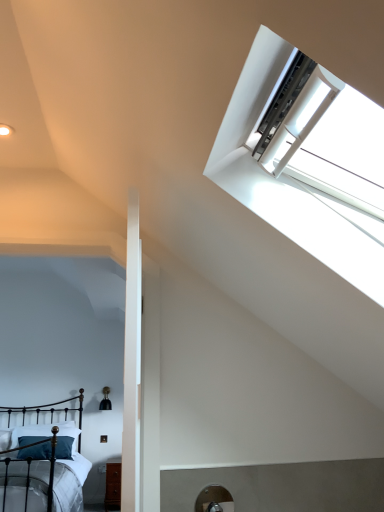
Question: Is dark blue fabric pillow at lower left in front of black wrought iron bed at lower left?

Choices:
 (A) yes
 (B) no

Answer: (B)

Question: Is dark blue fabric pillow at lower left at the left side of black wrought iron bed at lower left?

Choices:
 (A) yes
 (B) no

Answer: (B)

Question: Is dark blue fabric pillow at lower left at the right side of black wrought iron bed at lower left?

Choices:
 (A) no
 (B) yes

Answer: (B)

Question: Does dark blue fabric pillow at lower left have a lesser width compared to black wrought iron bed at lower left?

Choices:
 (A) no
 (B) yes

Answer: (B)

Question: Can you confirm if dark blue fabric pillow at lower left is smaller than black wrought iron bed at lower left?

Choices:
 (A) yes
 (B) no

Answer: (A)

Question: Is dark blue fabric pillow at lower left positioned with its back to black wrought iron bed at lower left?

Choices:
 (A) no
 (B) yes

Answer: (B)

Question: Is white plastic window at upper right surrounding black wrought iron bed at lower left?

Choices:
 (A) yes
 (B) no

Answer: (B)

Question: From the image's perspective, is white plastic window at upper right above black wrought iron bed at lower left?

Choices:
 (A) no
 (B) yes

Answer: (B)

Question: Is white plastic window at upper right in front of black wrought iron bed at lower left?

Choices:
 (A) yes
 (B) no

Answer: (A)

Question: Can you confirm if white plastic window at upper right is taller than black wrought iron bed at lower left?

Choices:
 (A) no
 (B) yes

Answer: (A)

Question: Considering the relative sizes of white plastic window at upper right and black wrought iron bed at lower left in the image provided, is white plastic window at upper right wider than black wrought iron bed at lower left?

Choices:
 (A) no
 (B) yes

Answer: (A)

Question: Is the depth of white plastic window at upper right greater than that of black wrought iron bed at lower left?

Choices:
 (A) yes
 (B) no

Answer: (B)

Question: Does black wrought iron bed at lower left touch white plastic window at upper right?

Choices:
 (A) yes
 (B) no

Answer: (B)